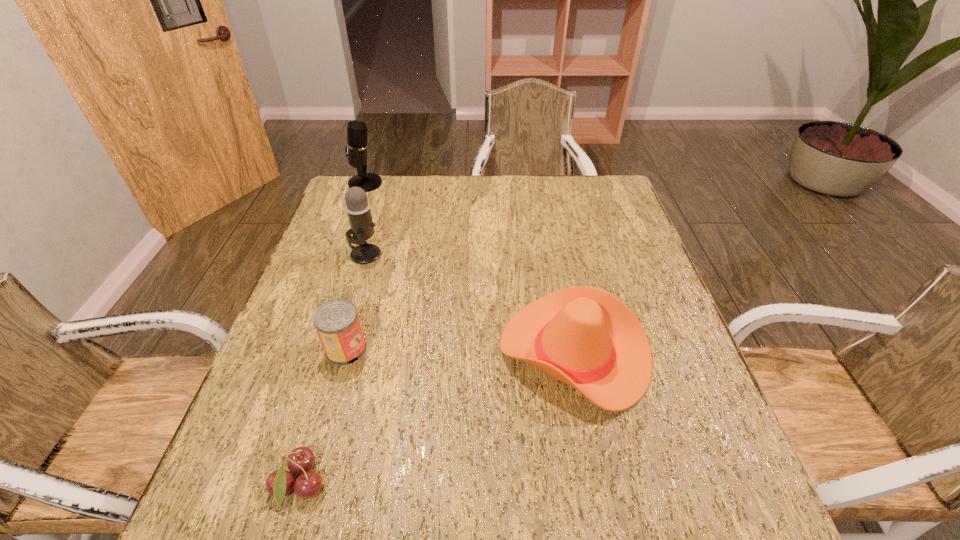
Locate which object ranks in proximity to the rightmost object. Please provide its 2D coordinates. Your answer should be formatted as a tuple, i.e. [(x, y)], where the tuple contains the x and y coordinates of a point satisfying the conditions above.

[(337, 323)]

Where is `object that is the second closest to the can`? Image resolution: width=960 pixels, height=540 pixels. object that is the second closest to the can is located at coordinates (358, 208).

Identify the location of free point that satisfies the following two spatial constraints: 1. on the front side of the rightmost object; 2. on the left side of the farther microphone. (304, 352).

The image size is (960, 540). I want to click on blank area in the image that satisfies the following two spatial constraints: 1. on the front side of the cowboy hat; 2. on the leaves of the nearest object, so click(600, 485).